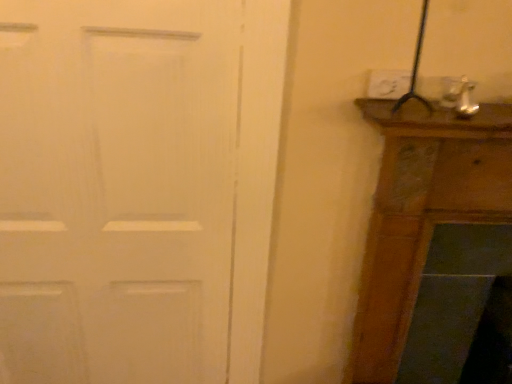
Question: Is white matte door at left spatially inside white plastic electric outlet at upper right, or outside of it?

Choices:
 (A) outside
 (B) inside

Answer: (A)

Question: From the image's perspective, is white matte door at left positioned above or below white plastic electric outlet at upper right?

Choices:
 (A) below
 (B) above

Answer: (A)

Question: Based on their positions, is white matte door at left located to the left or right of white plastic electric outlet at upper right?

Choices:
 (A) left
 (B) right

Answer: (A)

Question: Is white plastic electric outlet at upper right spatially inside white matte door at left, or outside of it?

Choices:
 (A) inside
 (B) outside

Answer: (B)

Question: Is white plastic electric outlet at upper right wider or thinner than white matte door at left?

Choices:
 (A) wide
 (B) thin

Answer: (B)

Question: Considering their positions, is white plastic electric outlet at upper right located in front of or behind white matte door at left?

Choices:
 (A) front
 (B) behind

Answer: (B)

Question: From the image's perspective, is white plastic electric outlet at upper right located above or below white matte door at left?

Choices:
 (A) below
 (B) above

Answer: (B)